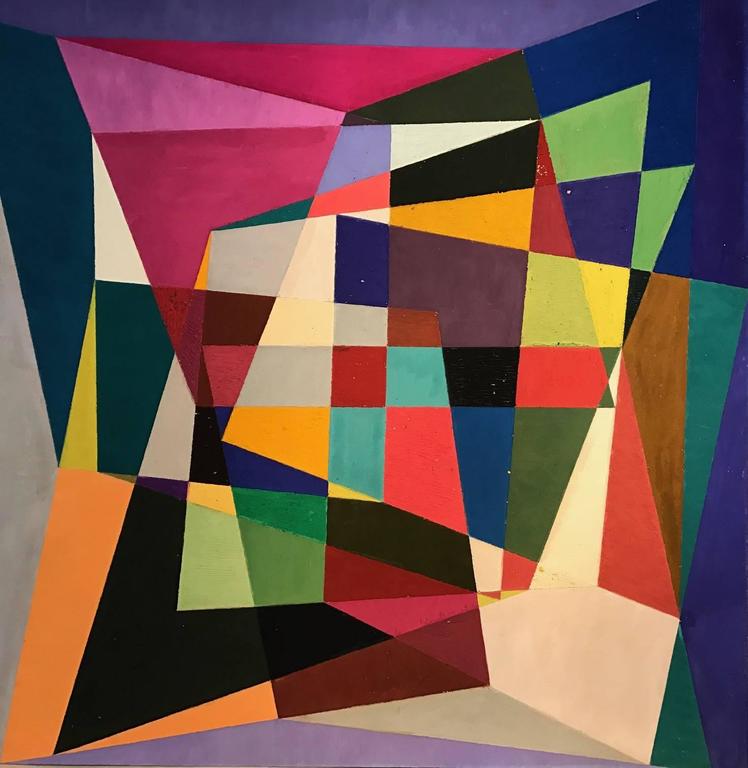
In order to click on painting in this screenshot , I will do `click(405, 293)`.